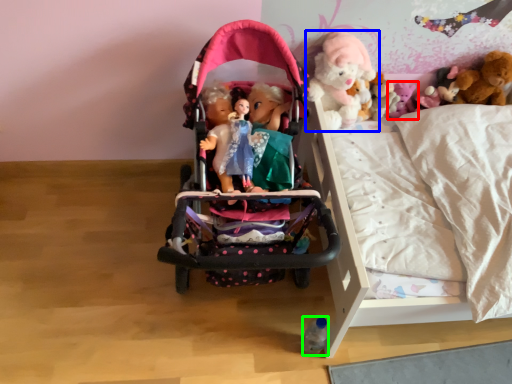
Question: Which object is the farthest from toy (highlighted by a red box)? Choose among these: toy (highlighted by a blue box) or toy (highlighted by a green box).

Choices:
 (A) toy
 (B) toy

Answer: (B)